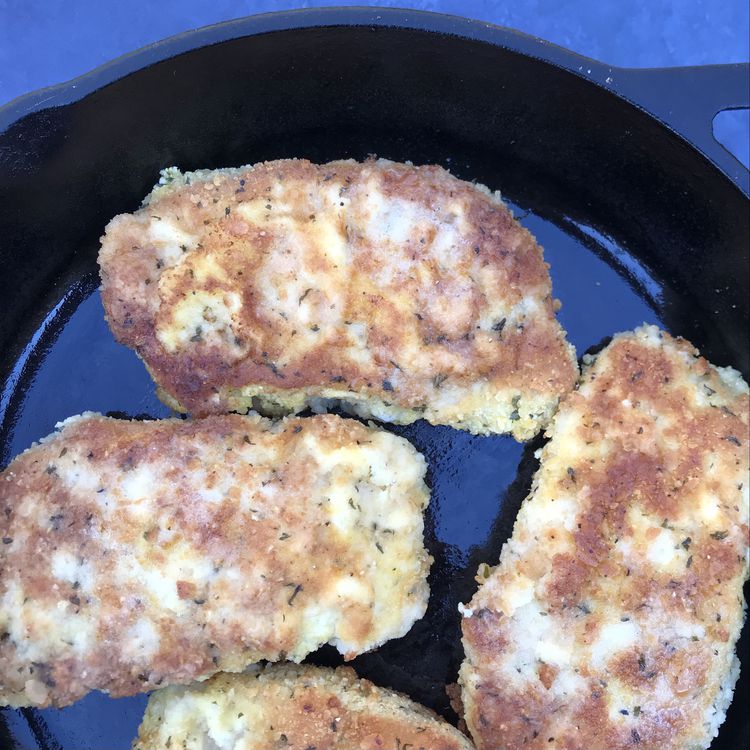
This screenshot has width=750, height=750. I want to click on handle, so click(660, 100).